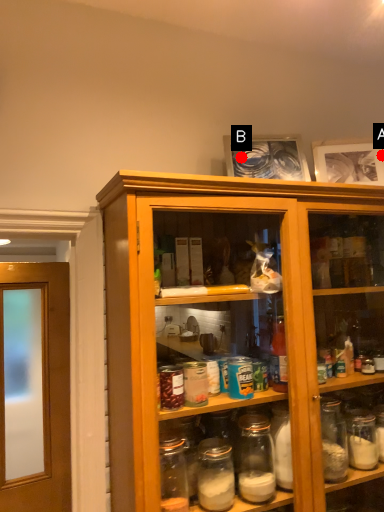
Question: Two points are circled on the image, labeled by A and B beside each circle. Which point is farther to the camera?

Choices:
 (A) A is further
 (B) B is further

Answer: (A)